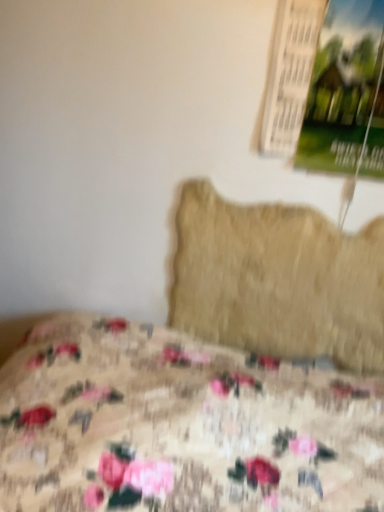
Question: From a real-world perspective, is green paper poster at upper right positioned over floral fabric bed at lower left based on gravity?

Choices:
 (A) no
 (B) yes

Answer: (B)

Question: Can you confirm if green paper poster at upper right is taller than floral fabric bed at lower left?

Choices:
 (A) no
 (B) yes

Answer: (A)

Question: Is green paper poster at upper right bigger than floral fabric bed at lower left?

Choices:
 (A) yes
 (B) no

Answer: (B)

Question: Can you confirm if green paper poster at upper right is positioned to the left of floral fabric bed at lower left?

Choices:
 (A) no
 (B) yes

Answer: (A)

Question: Is green paper poster at upper right positioned with its back to floral fabric bed at lower left?

Choices:
 (A) no
 (B) yes

Answer: (A)

Question: From a real-world perspective, is beige fuzzy pillow at center physically located above or below floral fabric bed at lower left?

Choices:
 (A) below
 (B) above

Answer: (B)

Question: In terms of height, does beige fuzzy pillow at center look taller or shorter compared to floral fabric bed at lower left?

Choices:
 (A) short
 (B) tall

Answer: (B)

Question: From the image's perspective, relative to floral fabric bed at lower left, is beige fuzzy pillow at center above or below?

Choices:
 (A) above
 (B) below

Answer: (A)

Question: Looking at their shapes, would you say beige fuzzy pillow at center is wider or thinner than floral fabric bed at lower left?

Choices:
 (A) wide
 (B) thin

Answer: (B)

Question: Is green paper poster at upper right taller or shorter than floral fabric bed at lower left?

Choices:
 (A) short
 (B) tall

Answer: (A)

Question: Relative to floral fabric bed at lower left, is green paper poster at upper right in front or behind?

Choices:
 (A) behind
 (B) front

Answer: (A)

Question: From a real-world perspective, is green paper poster at upper right positioned above or below floral fabric bed at lower left?

Choices:
 (A) below
 (B) above

Answer: (B)

Question: From the image's perspective, relative to floral fabric bed at lower left, is green paper poster at upper right above or below?

Choices:
 (A) below
 (B) above

Answer: (B)

Question: Is beige fuzzy pillow at center in front of or behind green paper poster at upper right in the image?

Choices:
 (A) front
 (B) behind

Answer: (B)

Question: Is beige fuzzy pillow at center situated inside green paper poster at upper right or outside?

Choices:
 (A) outside
 (B) inside

Answer: (A)